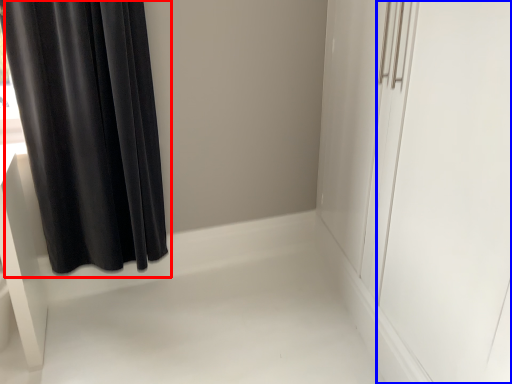
Question: Which of the following is the farthest to the observer, curtain (highlighted by a red box) or screen door (highlighted by a blue box)?

Choices:
 (A) curtain
 (B) screen door

Answer: (A)